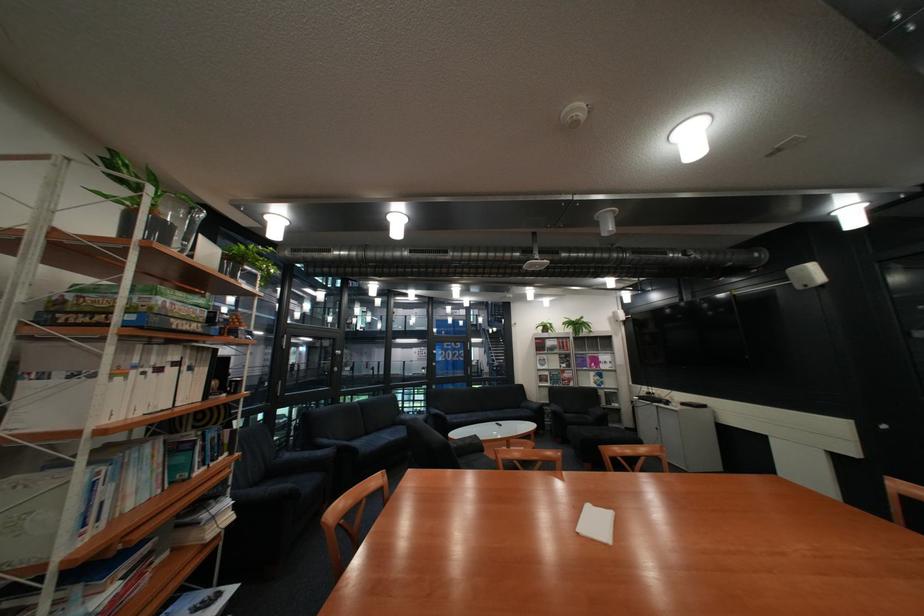
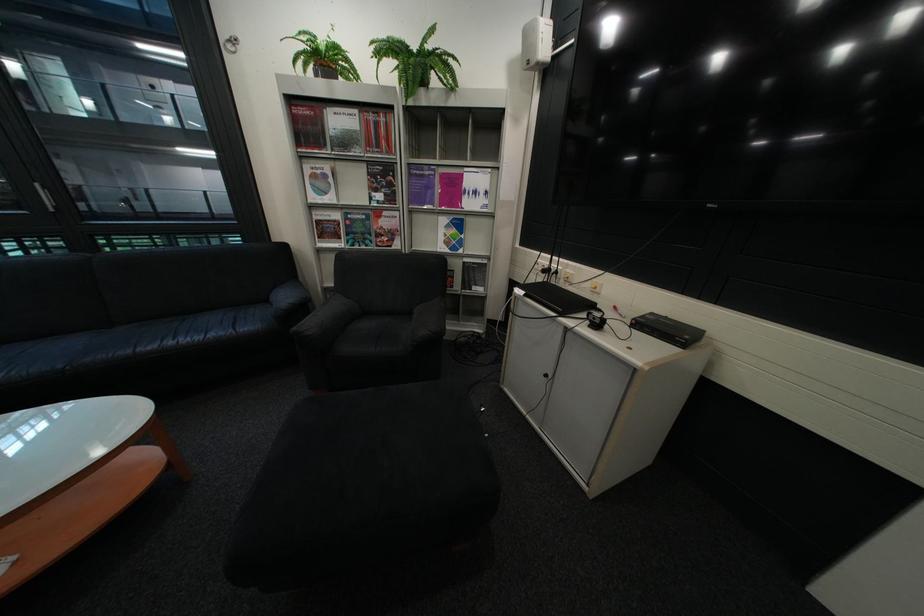
In the second image, find the point that corresponds to (x=590, y=320) in the first image.

(430, 46)